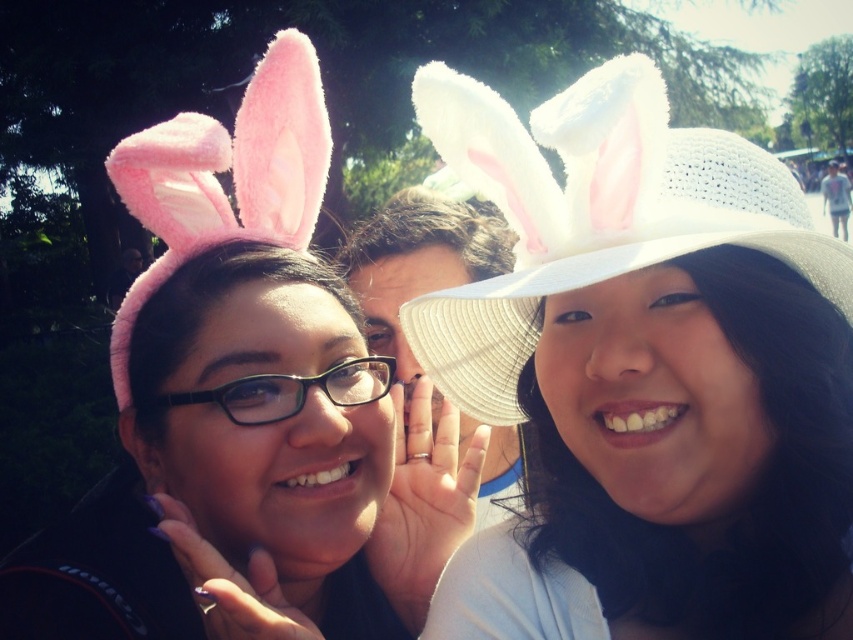
Question: Is white woven hat at upper right to the left of pink fluffy hat at left from the viewer's perspective?

Choices:
 (A) no
 (B) yes

Answer: (A)

Question: Which is farther from the white woven hat at upper right?

Choices:
 (A) pink fluffy hat at left
 (B) white woven hat at center
 (C) black plastic glasses at center

Answer: (A)

Question: Is pink fluffy hat at left behind black plastic glasses at center?

Choices:
 (A) yes
 (B) no

Answer: (A)

Question: Which point is farther to the camera?

Choices:
 (A) (431, 324)
 (B) (283, 417)
 (C) (283, 212)
 (D) (393, 252)

Answer: (D)

Question: Among these points, which one is nearest to the camera?

Choices:
 (A) (451, 284)
 (B) (154, 406)
 (C) (422, 368)
 (D) (131, 184)

Answer: (B)

Question: Is white woven hat at center above black plastic glasses at center?

Choices:
 (A) yes
 (B) no

Answer: (A)